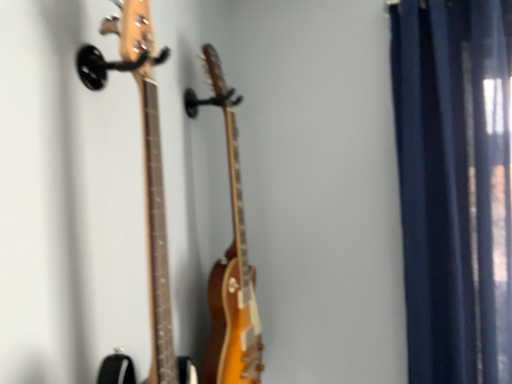
Question: Looking at their shapes, would you say dark blue fabric curtain at right is wider or thinner than glossy wood guitar at center, which ranks as the 1th guitar in back-to-front order?

Choices:
 (A) thin
 (B) wide

Answer: (B)

Question: Is dark blue fabric curtain at right in front of or behind glossy wood guitar at center, which appears as the 2th guitar when viewed from the front, in the image?

Choices:
 (A) front
 (B) behind

Answer: (B)

Question: Estimate the real-world distances between objects in this image. Which object is closer to the dark blue fabric curtain at right?

Choices:
 (A) natural wood guitar at left, placed as the 1th guitar when sorted from front to back
 (B) glossy wood guitar at center, which ranks as the 1th guitar in back-to-front order

Answer: (B)

Question: Which is nearer to the dark blue fabric curtain at right?

Choices:
 (A) glossy wood guitar at center, which appears as the 2th guitar when viewed from the front
 (B) natural wood guitar at left, placed as the 1th guitar when sorted from front to back

Answer: (A)